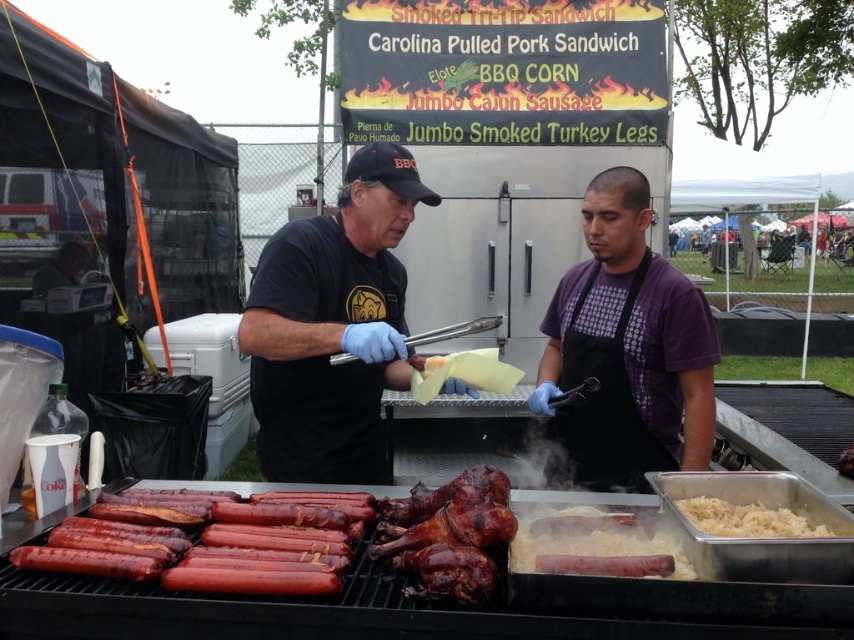
Image resolution: width=854 pixels, height=640 pixels. What do you see at coordinates (448, 536) in the screenshot?
I see `shiny brown meat at center` at bounding box center [448, 536].

The height and width of the screenshot is (640, 854). In order to click on shiny brown meat at center in this screenshot , I will do `click(448, 536)`.

Between smokey brown sausage at center and white shredded cabbage at lower right, which one has more height?

smokey brown sausage at center

Which is below, smokey brown sausage at center or white shredded cabbage at lower right?

smokey brown sausage at center

The width and height of the screenshot is (854, 640). I want to click on smokey brown sausage at center, so click(592, 541).

Locate an element on the screen. smokey brown sausage at center is located at coordinates (592, 541).

Who is lower down, charred glossy hot dogs at center or white shredded cabbage at lower right?

charred glossy hot dogs at center is below.

Find the location of a particular element. charred glossy hot dogs at center is located at coordinates (211, 554).

What do you see at coordinates (211, 554) in the screenshot? The height and width of the screenshot is (640, 854). I see `charred glossy hot dogs at center` at bounding box center [211, 554].

Where is `charred glossy hot dogs at center`? The width and height of the screenshot is (854, 640). charred glossy hot dogs at center is located at coordinates (211, 554).